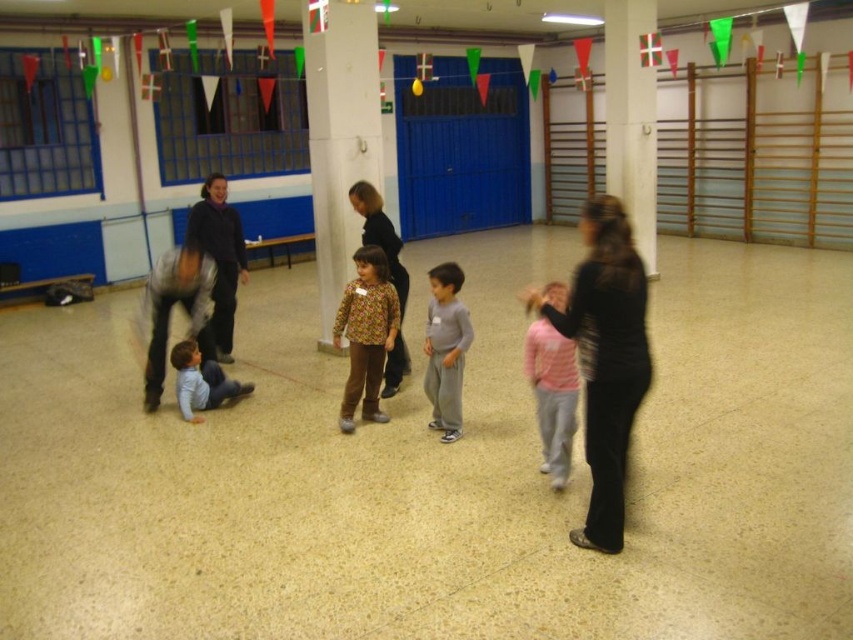
Which of these two, black matte jacket at center or blue soft shirt at lower left, stands shorter?

With less height is blue soft shirt at lower left.

Which is in front, point (230, 211) or point (242, 394)?

Point (242, 394)

Which is behind, point (192, 237) or point (186, 392)?

The point (192, 237) is more distant.

Locate an element on the screen. The image size is (853, 640). black matte jacket at center is located at coordinates (219, 257).

Can you confirm if black fabric jacket at center is positioned above floral-patterned shirt at center?

No.

Which is more to the right, black fabric jacket at center or floral-patterned shirt at center?

Positioned to the right is black fabric jacket at center.

The width and height of the screenshot is (853, 640). Describe the element at coordinates (605, 358) in the screenshot. I see `black fabric jacket at center` at that location.

Image resolution: width=853 pixels, height=640 pixels. In order to click on black fabric jacket at center in this screenshot , I will do `click(605, 358)`.

Between black fabric jacket at center and pink cotton shirt at center, which one is positioned higher?

Positioned higher is black fabric jacket at center.

Is black fabric jacket at center shorter than pink cotton shirt at center?

Incorrect, black fabric jacket at center's height does not fall short of pink cotton shirt at center's.

What do you see at coordinates (605, 358) in the screenshot? I see `black fabric jacket at center` at bounding box center [605, 358].

Locate an element on the screen. The width and height of the screenshot is (853, 640). black fabric jacket at center is located at coordinates (605, 358).